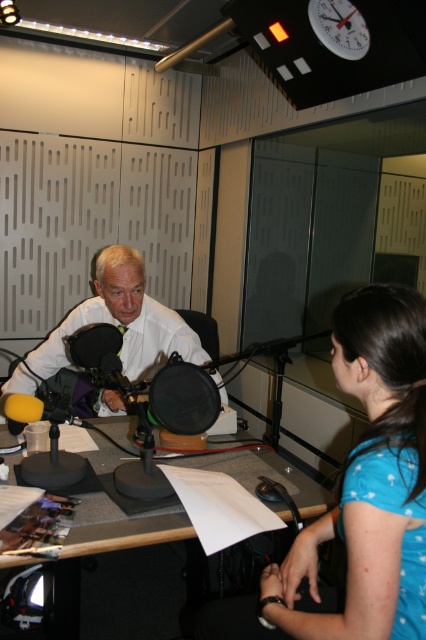
Question: Which of the following is the farthest from the observer?

Choices:
 (A) white glossy shirt at center
 (B) gray matte desk at center
 (C) white plastic clock at upper center

Answer: (C)

Question: Does gray matte desk at center have a larger size compared to white plastic clock at upper center?

Choices:
 (A) no
 (B) yes

Answer: (B)

Question: Is blue cotton shirt at lower right thinner than white glossy shirt at center?

Choices:
 (A) yes
 (B) no

Answer: (A)

Question: Estimate the real-world distances between objects in this image. Which object is closer to the blue cotton shirt at lower right?

Choices:
 (A) gray matte desk at center
 (B) white plastic clock at upper center
 (C) white glossy shirt at center

Answer: (A)

Question: Is blue cotton shirt at lower right to the left of gray matte desk at center from the viewer's perspective?

Choices:
 (A) yes
 (B) no

Answer: (B)

Question: Which of the following is the farthest from the observer?

Choices:
 (A) (288, 550)
 (B) (348, 35)
 (C) (169, 320)

Answer: (B)